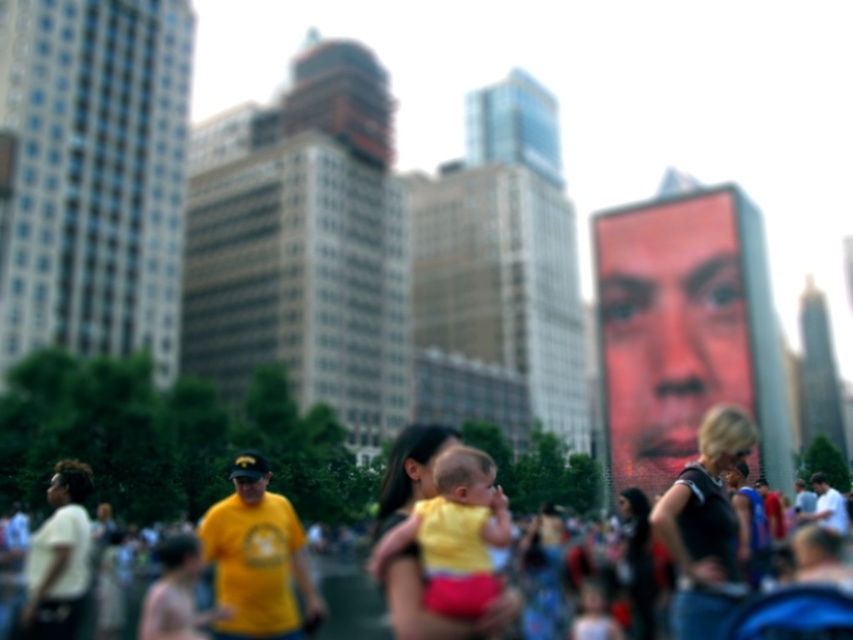
Is black matte dress at center to the left of white matte shirt at lower left from the viewer's perspective?

No, black matte dress at center is not to the left of white matte shirt at lower left.

Looking at this image, is black matte dress at center to the right of white matte shirt at lower left from the viewer's perspective?

Indeed, black matte dress at center is positioned on the right side of white matte shirt at lower left.

What do you see at coordinates (705, 525) in the screenshot?
I see `black matte dress at center` at bounding box center [705, 525].

Locate an element on the screen. Image resolution: width=853 pixels, height=640 pixels. black matte dress at center is located at coordinates (705, 525).

In the scene shown: Can you confirm if black matte dress at center is thinner than yellow fabric baby at center?

Result: Incorrect, black matte dress at center's width is not less than yellow fabric baby at center's.

Who is more forward, (697, 460) or (469, 474)?

Point (469, 474) is more forward.

Who is more forward, [695,588] or [485,522]?

Point [485,522]

You are a GUI agent. You are given a task and a screenshot of the screen. Output one action in this format:
    pyautogui.click(x=<x>, y=<y>)
    Task: Click on the black matte dress at center
    The width and height of the screenshot is (853, 640).
    Given the screenshot: What is the action you would take?
    pyautogui.click(x=705, y=525)

Who is positioned more to the right, yellow fabric baby at center or white matte shirt at lower left?

Positioned to the right is yellow fabric baby at center.

Who is higher up, yellow fabric baby at center or white matte shirt at lower left?

Positioned higher is yellow fabric baby at center.

Between point (445, 492) and point (68, 532), which one is positioned behind?

The point (68, 532) is behind.

The width and height of the screenshot is (853, 640). Identify the location of yellow fabric baby at center. (454, 534).